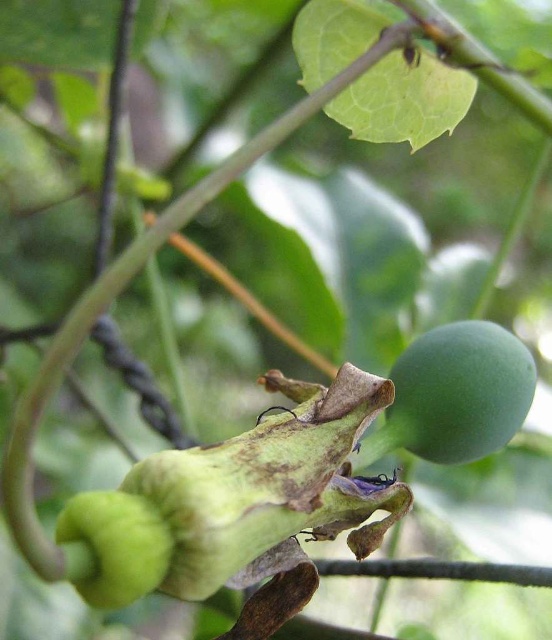
Question: Which object appears closest to the camera in this image?

Choices:
 (A) green matte fruit at lower left
 (B) green matte fruit at upper right

Answer: (A)

Question: Is green matte fruit at upper right positioned before green matte fruit at lower left?

Choices:
 (A) yes
 (B) no

Answer: (B)

Question: Among these objects, which one is nearest to the camera?

Choices:
 (A) green matte fruit at lower left
 (B) green matte fruit at upper right

Answer: (A)

Question: Is green matte fruit at upper right above green matte fruit at lower left?

Choices:
 (A) yes
 (B) no

Answer: (A)

Question: Does green matte fruit at upper right have a larger size compared to green matte fruit at lower left?

Choices:
 (A) no
 (B) yes

Answer: (B)